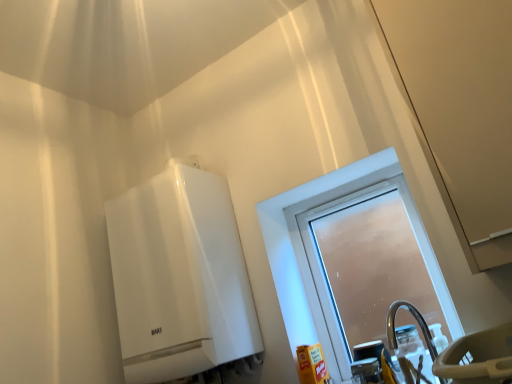
Question: Is transparent plastic screen door at upper right at the left side of translucent plastic bottle at lower right?

Choices:
 (A) yes
 (B) no

Answer: (B)

Question: Is transparent plastic screen door at upper right with translucent plastic bottle at lower right?

Choices:
 (A) no
 (B) yes

Answer: (A)

Question: Is transparent plastic screen door at upper right outside translucent plastic bottle at lower right?

Choices:
 (A) no
 (B) yes

Answer: (B)

Question: Could you tell me if transparent plastic screen door at upper right is turned towards translucent plastic bottle at lower right?

Choices:
 (A) yes
 (B) no

Answer: (B)

Question: From a real-world perspective, is transparent plastic screen door at upper right on translucent plastic bottle at lower right?

Choices:
 (A) no
 (B) yes

Answer: (B)

Question: From the image's perspective, is transparent plastic screen door at upper right located above translucent plastic bottle at lower right?

Choices:
 (A) no
 (B) yes

Answer: (B)

Question: Are white glossy water heater at upper left and transparent plastic screen door at upper right far apart?

Choices:
 (A) no
 (B) yes

Answer: (A)

Question: Can you confirm if white glossy water heater at upper left is bigger than transparent plastic screen door at upper right?

Choices:
 (A) yes
 (B) no

Answer: (A)

Question: Considering the relative sizes of white glossy water heater at upper left and transparent plastic screen door at upper right in the image provided, is white glossy water heater at upper left smaller than transparent plastic screen door at upper right?

Choices:
 (A) yes
 (B) no

Answer: (B)

Question: From the image's perspective, is white glossy water heater at upper left under transparent plastic screen door at upper right?

Choices:
 (A) yes
 (B) no

Answer: (A)

Question: Does white glossy water heater at upper left turn towards transparent plastic screen door at upper right?

Choices:
 (A) yes
 (B) no

Answer: (B)

Question: From the image's perspective, is white glossy water heater at upper left on top of transparent plastic screen door at upper right?

Choices:
 (A) no
 (B) yes

Answer: (A)

Question: Is transparent plastic screen door at upper right taller than frosted glass window at center?

Choices:
 (A) no
 (B) yes

Answer: (B)